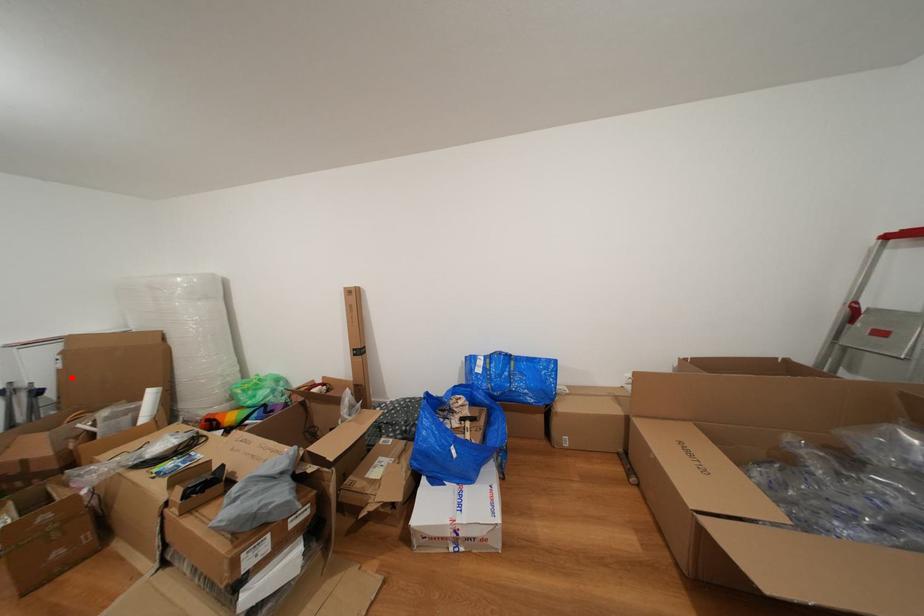
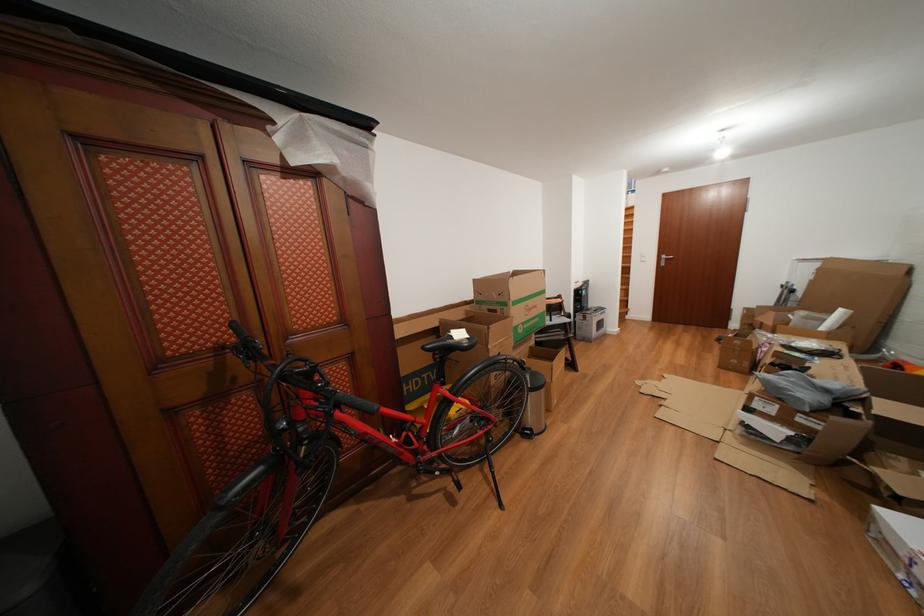
Question: I am providing you with two images of the same scene from different viewpoints. A red point is marked on the first image. Is the red point's position out of view in image 2?

Choices:
 (A) Yes
 (B) No

Answer: (B)